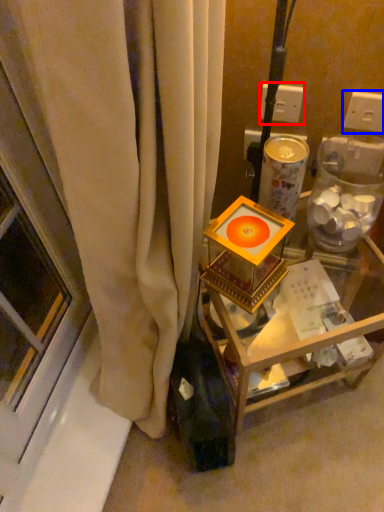
Question: Which of the following is the farthest to the observer, electric outlet (highlighted by a red box) or electric outlet (highlighted by a blue box)?

Choices:
 (A) electric outlet
 (B) electric outlet

Answer: (A)